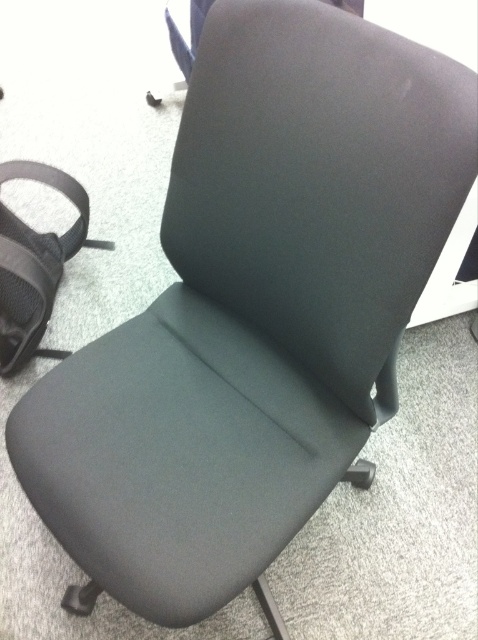
You are standing in an office and see the black office chair at center. Where is the point located at coordinates (x=318, y=180) in relation to the chair?

The point at coordinates (x=318, y=180) marks the dark gray fabric chair at center.

You are standing in front of the dark gray fabric chair at center. If you take one step forward, will your feet land in front of or behind the chair?

The dark gray fabric chair at center is 24.70 inches away from the viewer. Assuming an average step length of about 2.5 feet, taking one step forward would place your feet approximately 30 inches from the chair, which is in front of it. Therefore, your feet would land in front of the chair.

You are organizing a small event and need to arrange chairs. You have a dark gray fabric chair at center and a black mesh strap at left. According to the image, which object is positioned to the right of the other?

The dark gray fabric chair at center is to the right of the black mesh strap at left.